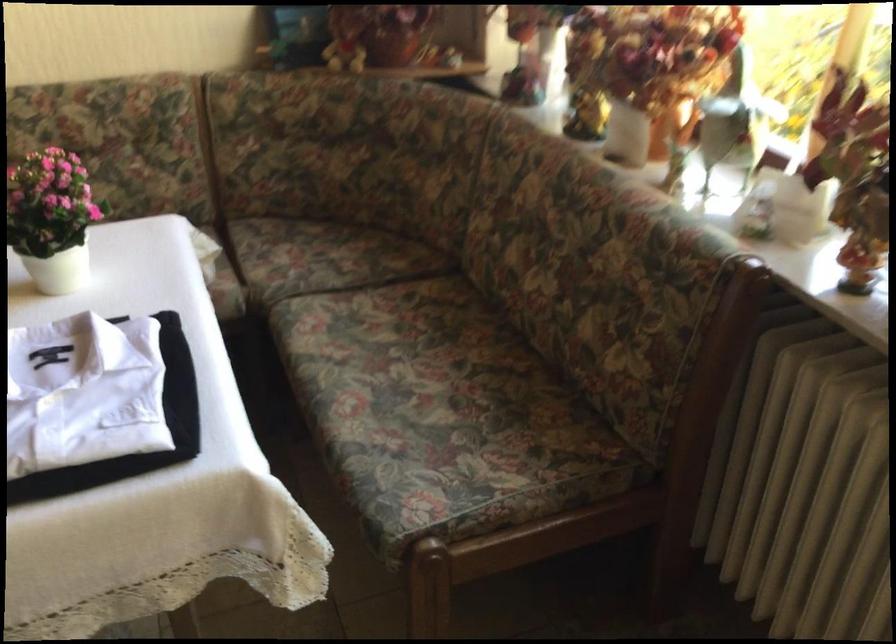
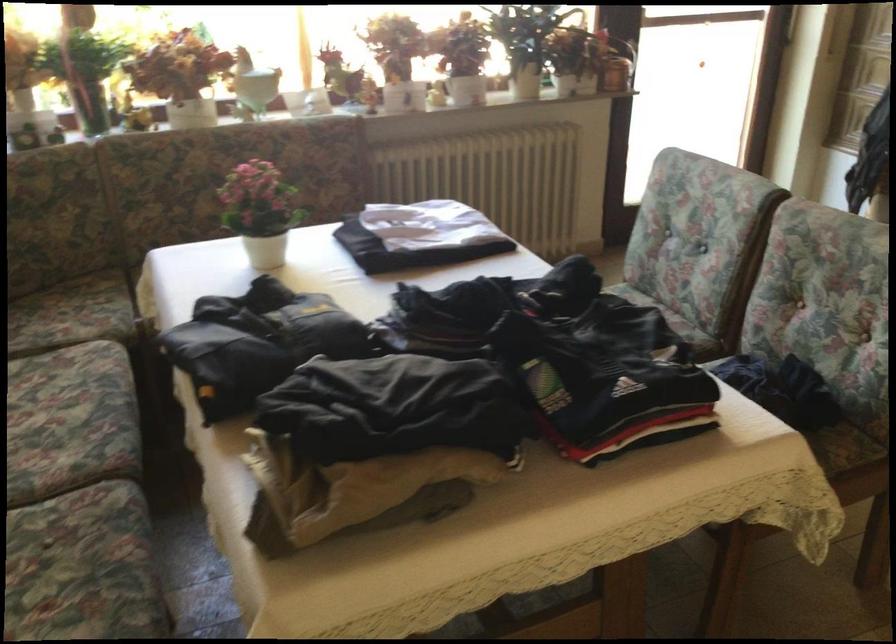
Question: I am providing you with two images of the same scene from different viewpoints. After the viewpoint changes to image2, which objects are now occluded?

Choices:
 (A) cylindrical speaker
 (B) ceramic figurine
 (C) chair sitting surface
 (D) floral sofa sitting surface

Answer: (D)